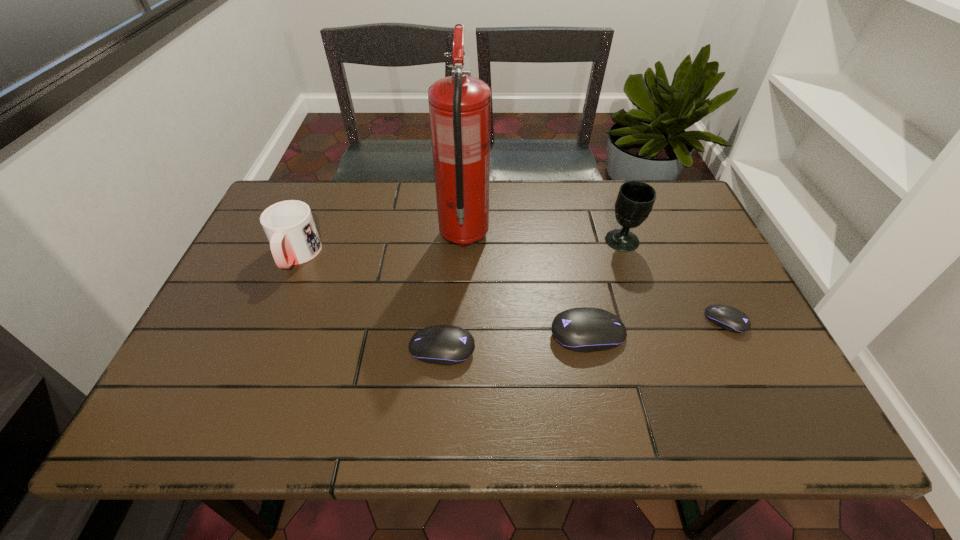
Identify the location of object located in the right edge section of the desktop. (731, 319).

Where is `vacant space at the far edge`? Image resolution: width=960 pixels, height=540 pixels. vacant space at the far edge is located at coordinates (598, 183).

In order to click on free space at the near edge of the desktop in this screenshot , I will do click(x=471, y=377).

Where is `free space at the left edge of the desktop`? The width and height of the screenshot is (960, 540). free space at the left edge of the desktop is located at coordinates (228, 324).

This screenshot has height=540, width=960. Find the location of `vacant space at the right edge of the desktop`. vacant space at the right edge of the desktop is located at coordinates (689, 237).

Locate an element on the screen. The width and height of the screenshot is (960, 540). vacant area that lies between the second tallest computer mouse and the fifth object from left to right is located at coordinates (532, 295).

Locate an element on the screen. This screenshot has width=960, height=540. vacant area that lies between the second shortest computer mouse and the third tallest object is located at coordinates (369, 302).

Identify the location of free space that is in between the fire extinguisher and the third object from right to left. This screenshot has height=540, width=960. (526, 285).

This screenshot has width=960, height=540. Find the location of `vacant area that lies between the second computer mouse from right to left and the fire extinguisher`. vacant area that lies between the second computer mouse from right to left and the fire extinguisher is located at coordinates (526, 285).

This screenshot has width=960, height=540. In order to click on vacant space that's between the second computer mouse from left to right and the leftmost object in this screenshot , I will do `click(442, 295)`.